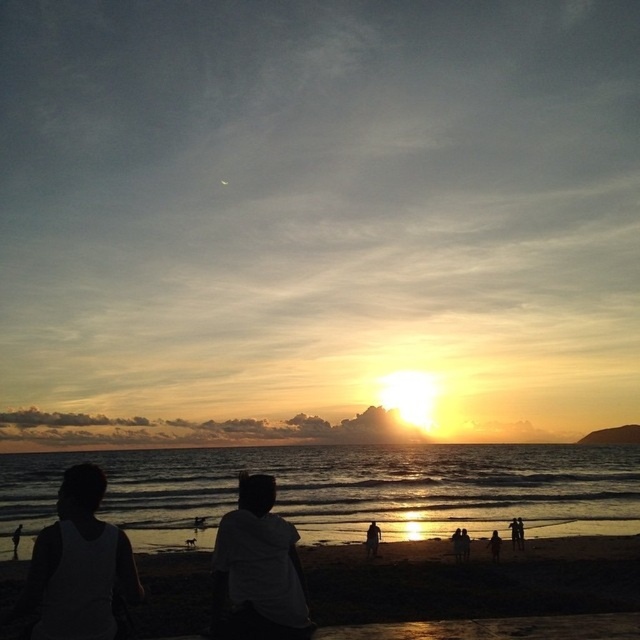
Between white matte tank top at lower left and silhouette figure at lower right, which one has less height?

With less height is silhouette figure at lower right.

Image resolution: width=640 pixels, height=640 pixels. I want to click on white matte tank top at lower left, so click(80, 564).

The width and height of the screenshot is (640, 640). I want to click on white matte tank top at lower left, so click(x=80, y=564).

Is silhouette sand at lower center further to the viewer compared to silhouette figure at lower right?

No.

Does silhouette sand at lower center appear over silhouette figure at lower right?

Yes.

Is point (627, 554) farther from camera compared to point (499, 548)?

No, (627, 554) is closer to viewer.

This screenshot has width=640, height=640. Find the location of `silhouette sand at lower center`. silhouette sand at lower center is located at coordinates [x=472, y=580].

Does silhouette sand at lower center have a lesser height compared to silhouette figure at center?

No.

In the scene shown: Can you confirm if silhouette sand at lower center is positioned to the left of silhouette figure at center?

Incorrect, silhouette sand at lower center is not on the left side of silhouette figure at center.

Measure the distance between point (620,580) and camera.

They are 21.58 meters apart.

Where is `silhouette sand at lower center`? This screenshot has width=640, height=640. silhouette sand at lower center is located at coordinates (472, 580).